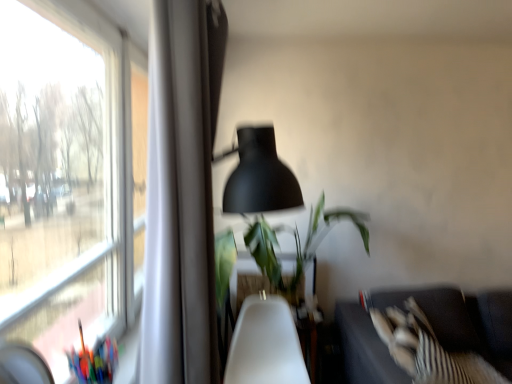
Identify the location of white plastic swivel chair at center. Image resolution: width=512 pixels, height=384 pixels. (265, 345).

This screenshot has height=384, width=512. Describe the element at coordinates (462, 320) in the screenshot. I see `dark gray fabric couch at lower right` at that location.

Measure the distance between point (247,247) and camera.

Point (247,247) is 8.98 feet from camera.

What do you see at coordinates (296, 248) in the screenshot?
I see `green leafy plant at center` at bounding box center [296, 248].

The height and width of the screenshot is (384, 512). I want to click on white plastic swivel chair at center, so click(265, 345).

Which of these two, green leafy plant at center or white plastic swivel chair at center, is thinner?

With smaller width is white plastic swivel chair at center.

From the image's perspective, who appears lower, green leafy plant at center or white plastic swivel chair at center?

From the image's view, white plastic swivel chair at center is below.

Which is in front, point (310, 243) or point (284, 318)?

The point (284, 318) is closer.

Who is taller, white plastic swivel chair at center or dark gray fabric couch at lower right?

With more height is dark gray fabric couch at lower right.

Is white plastic swivel chair at center closer to the viewer compared to dark gray fabric couch at lower right?

No, white plastic swivel chair at center is further to the viewer.

From a real-world perspective, relative to dark gray fabric couch at lower right, is white plastic swivel chair at center vertically above or below?

Clearly, from a real-world perspective, white plastic swivel chair at center is above dark gray fabric couch at lower right.

Is white plastic swivel chair at center positioned beyond the bounds of dark gray fabric couch at lower right?

That's correct, white plastic swivel chair at center is outside of dark gray fabric couch at lower right.

Is the position of dark gray fabric couch at lower right more distant than that of green leafy plant at center?

No, it is in front of green leafy plant at center.

Locate an element on the screen. The image size is (512, 384). houseplant located behind the dark gray fabric couch at lower right is located at coordinates (296, 248).

From a real-world perspective, is dark gray fabric couch at lower right on green leafy plant at center?

Actually, dark gray fabric couch at lower right is physically below green leafy plant at center in the real world.

Is matte black lampshade at center situated inside dark gray fabric couch at lower right or outside?

matte black lampshade at center is outside dark gray fabric couch at lower right.

From a real-world perspective, is matte black lampshade at center beneath dark gray fabric couch at lower right?

No.

Which is closer to the camera, (x=243, y=189) or (x=439, y=322)?

Positioned in front is point (x=243, y=189).

Between matte black lampshade at center and dark gray fabric couch at lower right, which one is positioned behind?

dark gray fabric couch at lower right is more distant.

Is green leafy plant at center far from matte black lampshade at center?

Yes, green leafy plant at center and matte black lampshade at center are located far from each other.

From the image's perspective, which one is positioned lower, green leafy plant at center or matte black lampshade at center?

From the image's view, green leafy plant at center is below.

Considering the points (261, 226) and (286, 176), which point is behind, point (261, 226) or point (286, 176)?

The point (261, 226) is behind.

From a real-world perspective, who is located higher, green leafy plant at center or matte black lampshade at center?

From a 3D spatial view, matte black lampshade at center is above.

In terms of height, does white plastic swivel chair at center look taller or shorter compared to green leafy plant at center?

Considering their sizes, white plastic swivel chair at center has less height than green leafy plant at center.

Which is less distant, (248, 348) or (268, 254)?

Point (248, 348) is positioned closer to the camera compared to point (268, 254).

Identify the location of houseplant above the white plastic swivel chair at center (from the image's perspective). (296, 248).

Considering the relative positions of white plastic swivel chair at center and green leafy plant at center in the image provided, is white plastic swivel chair at center to the left of green leafy plant at center from the viewer's perspective?

Correct, you'll find white plastic swivel chair at center to the left of green leafy plant at center.

How distant is matte black lampshade at center from green leafy plant at center?

A distance of 3.81 feet exists between matte black lampshade at center and green leafy plant at center.

In terms of height, does matte black lampshade at center look taller or shorter compared to green leafy plant at center?

Considering their sizes, matte black lampshade at center has more height than green leafy plant at center.

Where is `table lamp in front of the green leafy plant at center`? table lamp in front of the green leafy plant at center is located at coordinates (260, 176).

From the picture: Is matte black lampshade at center not inside green leafy plant at center?

Absolutely, matte black lampshade at center is external to green leafy plant at center.

Identify the location of houseplant on the right of white plastic swivel chair at center. (296, 248).

Where is `couch below the white plastic swivel chair at center (from a real-world perspective)`? This screenshot has width=512, height=384. couch below the white plastic swivel chair at center (from a real-world perspective) is located at coordinates (462, 320).

Looking at this image, from the image, which object appears to be farther from green leafy plant at center, dark gray fabric couch at lower right or matte black lampshade at center?

The object further to green leafy plant at center is matte black lampshade at center.

When comparing their distances from green leafy plant at center, does white plastic swivel chair at center or dark gray fabric couch at lower right seem closer?

Among the two, white plastic swivel chair at center is located nearer to green leafy plant at center.

Looking at the image, which one is located closer to white plastic swivel chair at center, green leafy plant at center or dark gray fabric couch at lower right?

green leafy plant at center is positioned closer to the anchor white plastic swivel chair at center.

Considering their positions, is white plastic swivel chair at center positioned closer to matte black lampshade at center than dark gray fabric couch at lower right?

white plastic swivel chair at center is closer to matte black lampshade at center.

Based on their spatial positions, is dark gray fabric couch at lower right or white plastic swivel chair at center further from matte black lampshade at center?

dark gray fabric couch at lower right.

Considering their positions, is matte black lampshade at center positioned closer to green leafy plant at center than white plastic swivel chair at center?

Among the two, white plastic swivel chair at center is located nearer to green leafy plant at center.

Considering their positions, is matte black lampshade at center positioned further to green leafy plant at center than dark gray fabric couch at lower right?

The object further to green leafy plant at center is matte black lampshade at center.

When comparing their distances from matte black lampshade at center, does green leafy plant at center or dark gray fabric couch at lower right seem closer?

The object closer to matte black lampshade at center is green leafy plant at center.

I want to click on houseplant situated between white plastic swivel chair at center and dark gray fabric couch at lower right from left to right, so (296, 248).

Locate an element on the screen. The height and width of the screenshot is (384, 512). houseplant between matte black lampshade at center and dark gray fabric couch at lower right in the horizontal direction is located at coordinates (296, 248).

I want to click on swivel chair between matte black lampshade at center and dark gray fabric couch at lower right in the horizontal direction, so click(x=265, y=345).

Find the location of a particular element. This screenshot has width=512, height=384. swivel chair between matte black lampshade at center and green leafy plant at center along the z-axis is located at coordinates click(x=265, y=345).